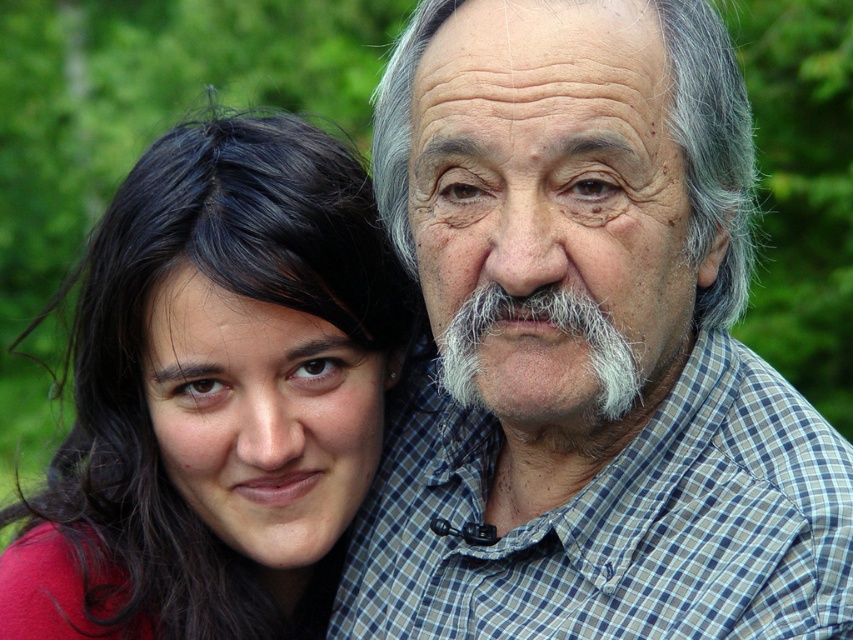
Does point (612, 323) come behind point (467, 401)?

No, it is in front of (467, 401).

Who is more distant from viewer, (553, 520) or (618, 387)?

The point (553, 520) is more distant.

The width and height of the screenshot is (853, 640). Identify the location of gray checkered shirt at upper right. (585, 346).

Can you confirm if matte black hair at left is smaller than gray/textured hair at upper center?

No, matte black hair at left is not smaller than gray/textured hair at upper center.

Is point (244, 620) positioned in front of point (689, 115)?

No, it is not.

Find the location of a particular element. The width and height of the screenshot is (853, 640). matte black hair at left is located at coordinates (215, 394).

The width and height of the screenshot is (853, 640). What do you see at coordinates (585, 346) in the screenshot?
I see `gray checkered shirt at upper right` at bounding box center [585, 346].

Between point (646, 33) and point (402, 248), which one is positioned behind?

The point (402, 248) is behind.

You are a GUI agent. You are given a task and a screenshot of the screen. Output one action in this format:
    pyautogui.click(x=<x>, y=<y>)
    Task: Click on the gray checkered shirt at upper right
    This screenshot has width=853, height=640.
    Given the screenshot: What is the action you would take?
    pyautogui.click(x=585, y=346)